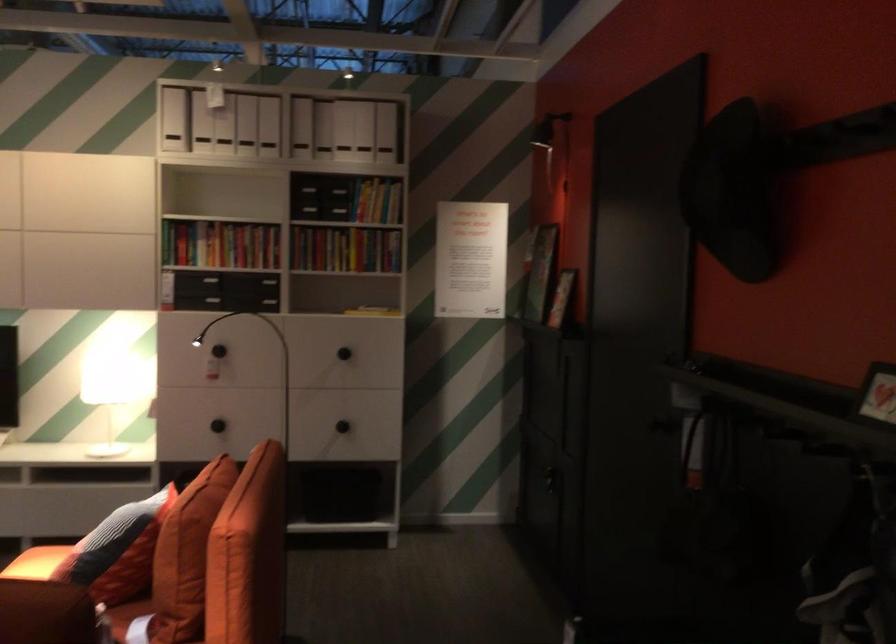
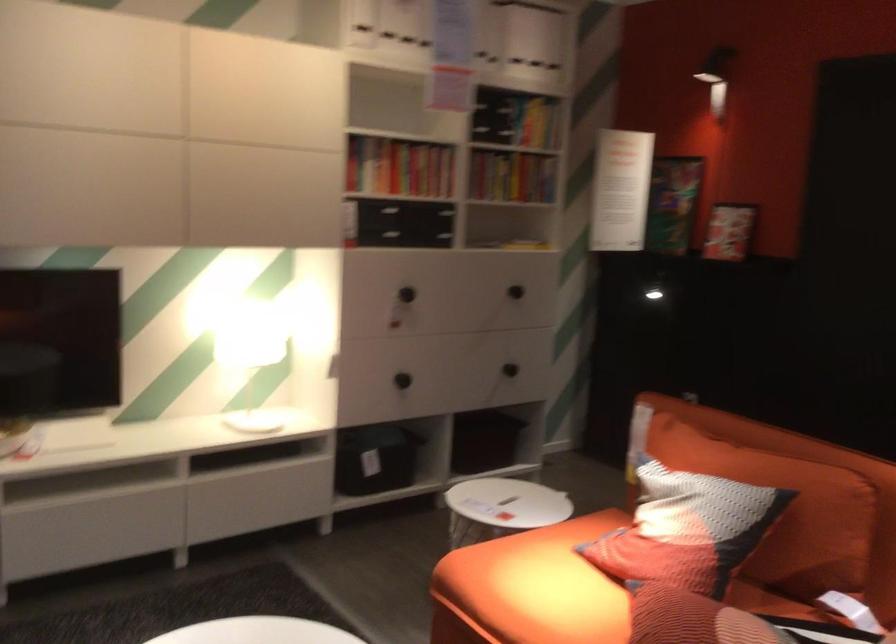
What movement of the cameraman would produce the second image?

The cameraman walked toward left, forward.